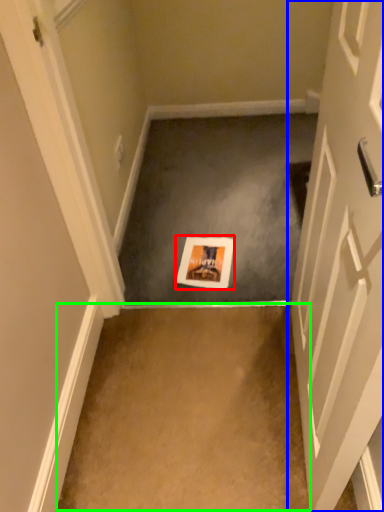
Question: Estimate the real-world distances between objects in this image. Which object is closer to postcard (highlighted by a red box), door (highlighted by a blue box) or concrete (highlighted by a green box)?

Choices:
 (A) door
 (B) concrete

Answer: (B)